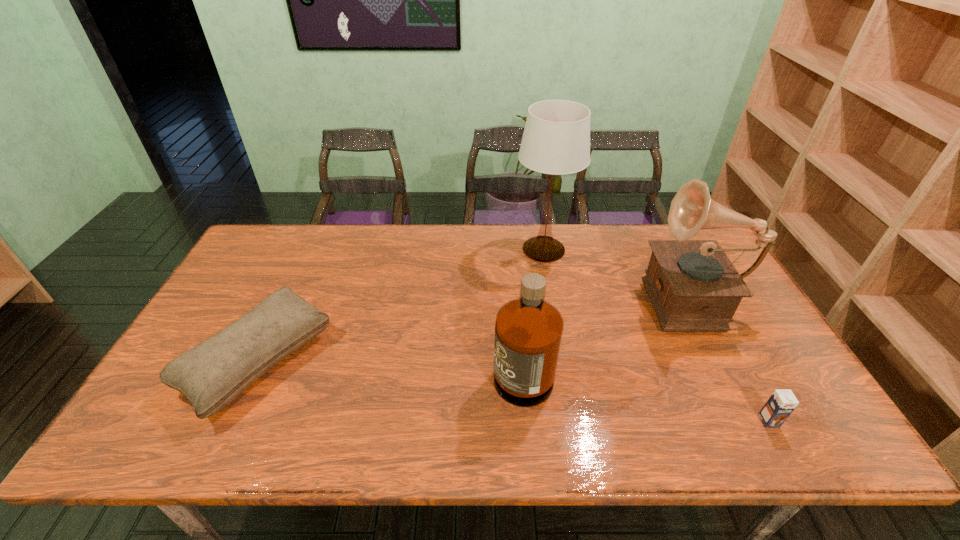
Locate an element on the screen. table lamp is located at coordinates (556, 141).

This screenshot has height=540, width=960. I want to click on record player, so click(x=693, y=286).

At what (x,y) coordinates should I click in order to perform the action: click on the third tallest object. Please return your answer as a coordinate pair (x, y). The width and height of the screenshot is (960, 540). Looking at the image, I should click on (528, 330).

Where is `the second shortest object`? the second shortest object is located at coordinates (212, 374).

Find the location of a particular element. the leftmost object is located at coordinates (212, 374).

At what (x,y) coordinates should I click in order to perform the action: click on the shortest object. Please return your answer as a coordinate pair (x, y). This screenshot has width=960, height=540. Looking at the image, I should click on (780, 405).

At what (x,y) coordinates should I click in order to perform the action: click on vacant space located above the cylindrical shade of the table lamp. Please return your answer as a coordinate pair (x, y). This screenshot has width=960, height=540. Looking at the image, I should click on (549, 284).

Locate an element on the screen. The width and height of the screenshot is (960, 540). blank space located 0.140m on the horn of the record player is located at coordinates (593, 296).

Identify the location of blank area located on the horn of the record player. This screenshot has height=540, width=960. (613, 296).

You are a GUI agent. You are given a task and a screenshot of the screen. Output one action in this format:
    pyautogui.click(x=<x>, y=<y>)
    Task: Click on the free space located on the horn of the record player
    The width and height of the screenshot is (960, 540).
    Given the screenshot: What is the action you would take?
    pyautogui.click(x=527, y=296)